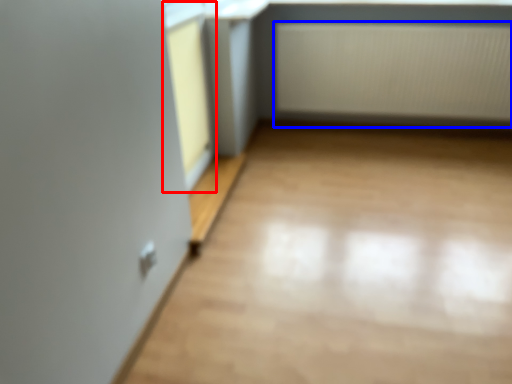
Question: Which object is further to the camera taking this photo, window frame (highlighted by a red box) or radiator (highlighted by a blue box)?

Choices:
 (A) window frame
 (B) radiator

Answer: (B)